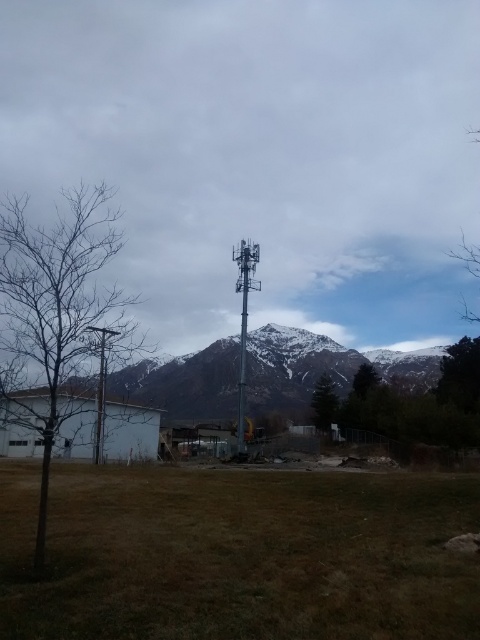
Question: Which point is farther to the camera?

Choices:
 (A) (60, 316)
 (B) (236, 253)

Answer: (B)

Question: Does bare branches at left have a lesser width compared to snowy metallic pole at center?

Choices:
 (A) no
 (B) yes

Answer: (B)

Question: Does snowy metallic pole at center appear on the left side of green textured tree at lower right?

Choices:
 (A) no
 (B) yes

Answer: (B)

Question: Is bare branches at left smaller than metallic pole at left?

Choices:
 (A) no
 (B) yes

Answer: (A)

Question: Estimate the real-world distances between objects in this image. Which object is closer to the green textured tree at lower right?

Choices:
 (A) green grass at center
 (B) snowy metallic pole at center

Answer: (B)

Question: Which point is farther to the camera?

Choices:
 (A) green grass at center
 (B) metallic gray telegraph pole at center
 (C) green textured tree at lower right
 (D) metallic pole at left

Answer: (C)